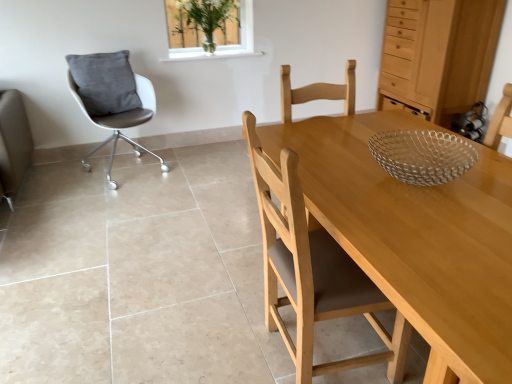
Question: Can white leather chair at left, the 1th chair positioned from the left, be found inside light brown wood chair at center, positioned as the second chair in left-to-right order?

Choices:
 (A) no
 (B) yes

Answer: (A)

Question: Can you confirm if light brown wood chair at center, which is counted as the first chair, starting from the right, is positioned to the left of white leather chair at left, acting as the 2th chair starting from the front?

Choices:
 (A) yes
 (B) no

Answer: (B)

Question: Can you confirm if light brown wood chair at center, which is counted as the first chair, starting from the right, is wider than white leather chair at left, which ranks as the second chair in right-to-left order?

Choices:
 (A) no
 (B) yes

Answer: (A)

Question: Is light brown wood chair at center, positioned as the second chair in left-to-right order, closer to camera compared to white leather chair at left, which ranks as the second chair in right-to-left order?

Choices:
 (A) yes
 (B) no

Answer: (A)

Question: Does light brown wood chair at center, which is the second chair in back-to-front order, turn towards white leather chair at left, the 1th chair positioned from the left?

Choices:
 (A) yes
 (B) no

Answer: (B)

Question: Can you confirm if light brown wood chair at center, which is the second chair in back-to-front order, is thinner than white leather chair at left, the 1th chair positioned from the left?

Choices:
 (A) yes
 (B) no

Answer: (A)

Question: Would you say clear glass vase at upper center contains gray velvety pillow at left?

Choices:
 (A) yes
 (B) no

Answer: (B)

Question: Considering the relative positions of clear glass vase at upper center and gray velvety pillow at left in the image provided, is clear glass vase at upper center behind gray velvety pillow at left?

Choices:
 (A) yes
 (B) no

Answer: (A)

Question: Is gray velvety pillow at left at the back of clear glass vase at upper center?

Choices:
 (A) no
 (B) yes

Answer: (A)

Question: Considering the relative positions of clear glass vase at upper center and gray velvety pillow at left in the image provided, is clear glass vase at upper center to the right of gray velvety pillow at left from the viewer's perspective?

Choices:
 (A) yes
 (B) no

Answer: (A)

Question: Is clear glass vase at upper center aimed at gray velvety pillow at left?

Choices:
 (A) no
 (B) yes

Answer: (A)

Question: Does clear glass vase at upper center come in front of gray velvety pillow at left?

Choices:
 (A) no
 (B) yes

Answer: (A)

Question: Could you tell me if light wood dresser at upper right is turned towards light brown wood chair at center, which is counted as the first chair, starting from the right?

Choices:
 (A) no
 (B) yes

Answer: (A)